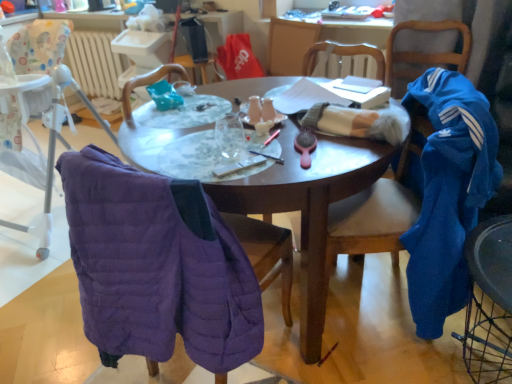
At what (x,y) coordinates should I click in order to perform the action: click on vacant area situated below velvet blue chair at right, which ranks as the 2th chair in right-to-left order (from a real-world perspective). Please return your answer as a coordinate pair (x, y). The image size is (512, 384). Looking at the image, I should click on (476, 360).